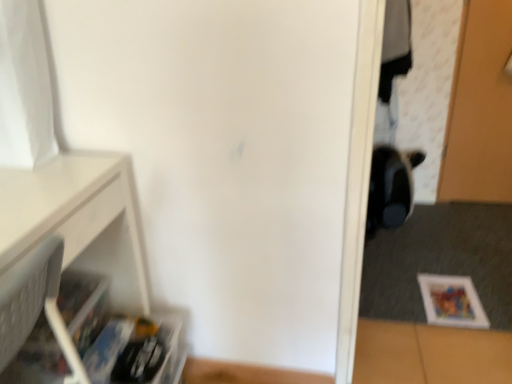
The image size is (512, 384). Describe the element at coordinates (480, 108) in the screenshot. I see `wooden door at right` at that location.

At what (x,y) coordinates should I click in order to perform the action: click on wooden door at right. Please return your answer as a coordinate pair (x, y). The image size is (512, 384). Looking at the image, I should click on (x=480, y=108).

Locate an element on the screen. The height and width of the screenshot is (384, 512). wooden door at right is located at coordinates (480, 108).